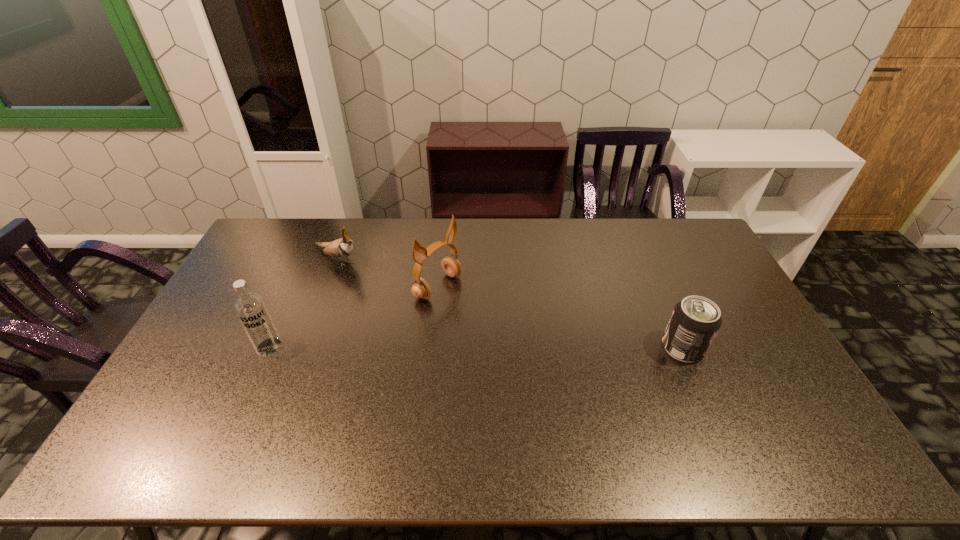
In order to click on free spot on the desktop that is between the vodka and the soda can and is positioned at the face of the bird in this screenshot , I will do `click(484, 347)`.

I want to click on vacant space on the desktop that is between the vodka and the rightmost object and is positioned on the front-facing side of the earphone, so click(x=534, y=347).